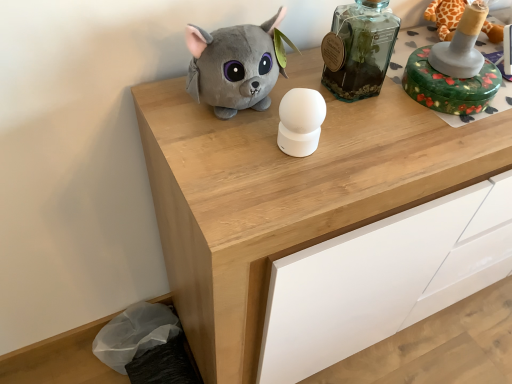
I want to click on vacant space to the right of soft plush cat at upper center, which is the 1th toy in left-to-right order, so click(x=362, y=132).